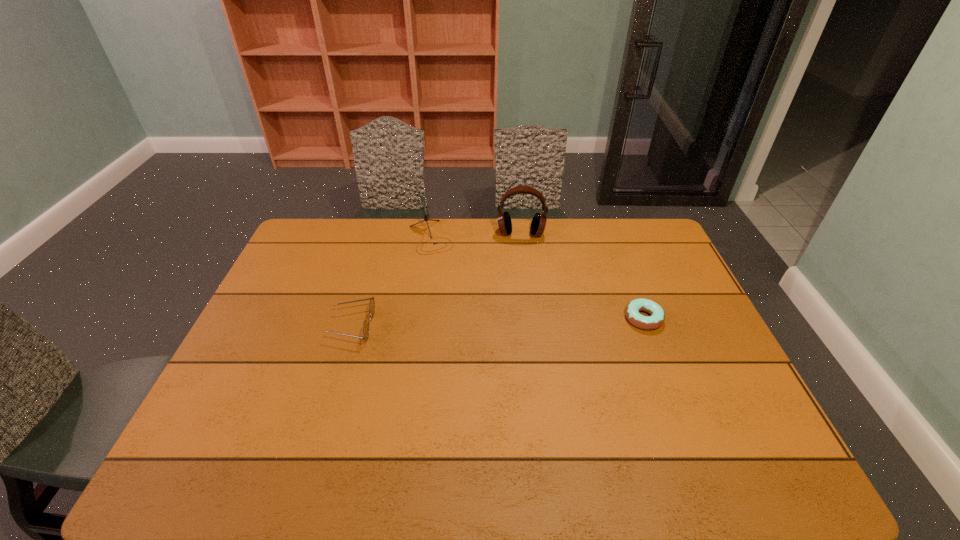
Where is `free space on the desktop that is between the third tallest object and the rightmost object and is positioned on the stand of the second tallest object`? The image size is (960, 540). free space on the desktop that is between the third tallest object and the rightmost object and is positioned on the stand of the second tallest object is located at coordinates (472, 323).

Image resolution: width=960 pixels, height=540 pixels. I want to click on vacant space on the desktop that is between the third tallest object and the doughnut and is positioned on the ear pads of the headset, so click(x=520, y=321).